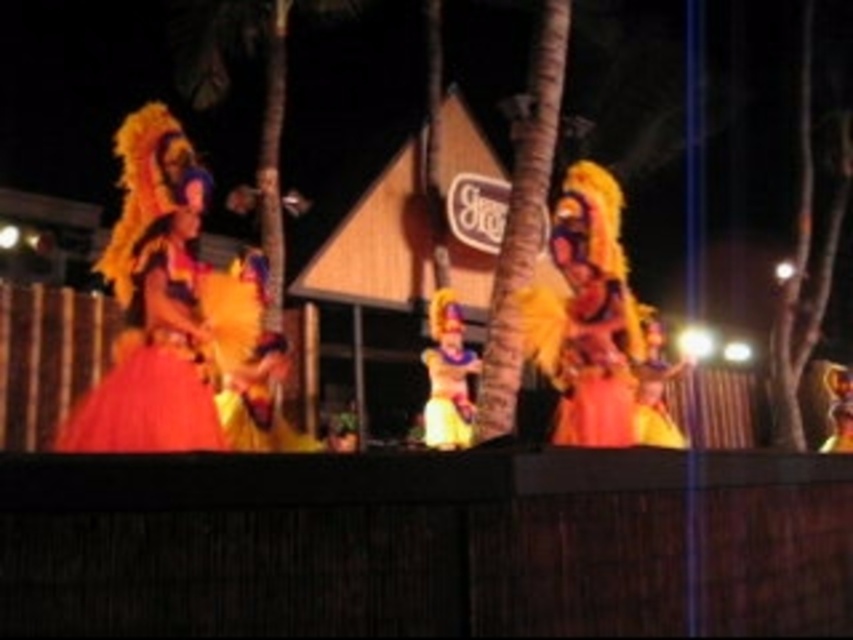
Between shiny orange dress at left and shiny gold costume at center, which one is positioned higher?

Positioned higher is shiny orange dress at left.

Which is behind, point (251, 337) or point (459, 348)?

The point (459, 348) is more distant.

I want to click on shiny orange dress at left, so click(x=163, y=305).

Between shiny orange dress at left and brown textured palm tree at center, which one has more height?

brown textured palm tree at center is taller.

Which is in front, point (221, 298) or point (192, 52)?

Positioned in front is point (221, 298).

Locate an element on the screen. shiny orange dress at left is located at coordinates (163, 305).

Who is positioned more to the left, shiny orange costume at center or brown textured palm tree at center?

brown textured palm tree at center

Is shiny orange costume at center closer to camera compared to brown textured palm tree at center?

Yes, shiny orange costume at center is in front of brown textured palm tree at center.

Identify the location of shiny orange costume at center. The image size is (853, 640). (593, 323).